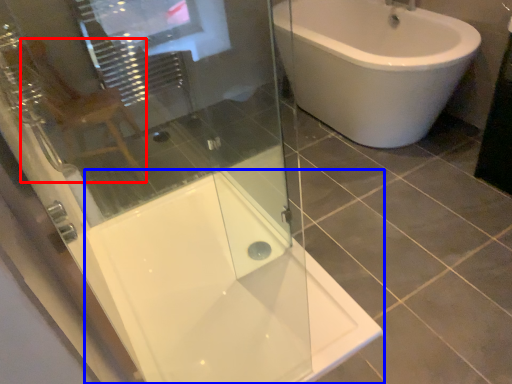
Question: Which point is closer to the camera, gray (highlighted by a red box) or bath (highlighted by a blue box)?

Choices:
 (A) gray
 (B) bath

Answer: (B)